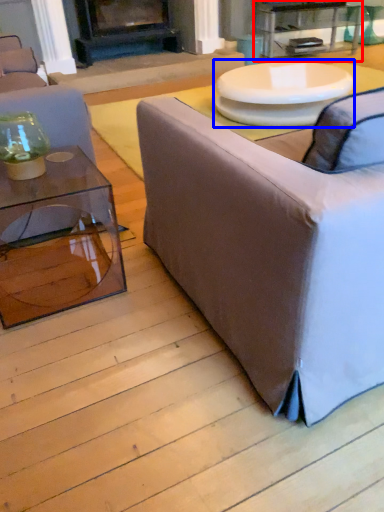
Question: Which object appears farthest to the camera in this image, table (highlighted by a red box) or round table (highlighted by a blue box)?

Choices:
 (A) table
 (B) round table

Answer: (A)